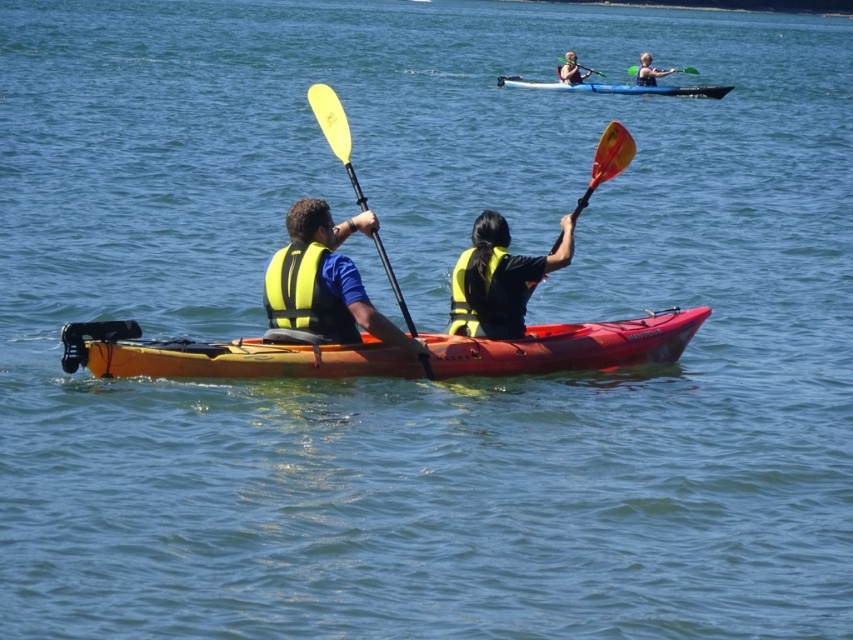
Question: Does yellow life vest at left appear over orange plastic paddle at center?

Choices:
 (A) no
 (B) yes

Answer: (A)

Question: Which of the following is the closest to the observer?

Choices:
 (A) (672, 353)
 (B) (352, 308)

Answer: (B)

Question: Which of the following is the closest to the observer?

Choices:
 (A) (451, 349)
 (B) (599, 72)
 (C) (314, 83)

Answer: (A)

Question: Considering the real-world distances, which object is farthest from the yellow matte life jacket at center?

Choices:
 (A) orange plastic paddle at center
 (B) yellow life vest at left
 (C) yellow matte life vest at center
 (D) orange plastic canoe at center

Answer: (A)

Question: Is yellow life vest at center in front of yellow plastic paddle at upper center?

Choices:
 (A) no
 (B) yes

Answer: (B)

Question: Where is blue plastic kayak at upper center located in relation to yellow rubber paddle at upper center in the image?

Choices:
 (A) left
 (B) right

Answer: (A)